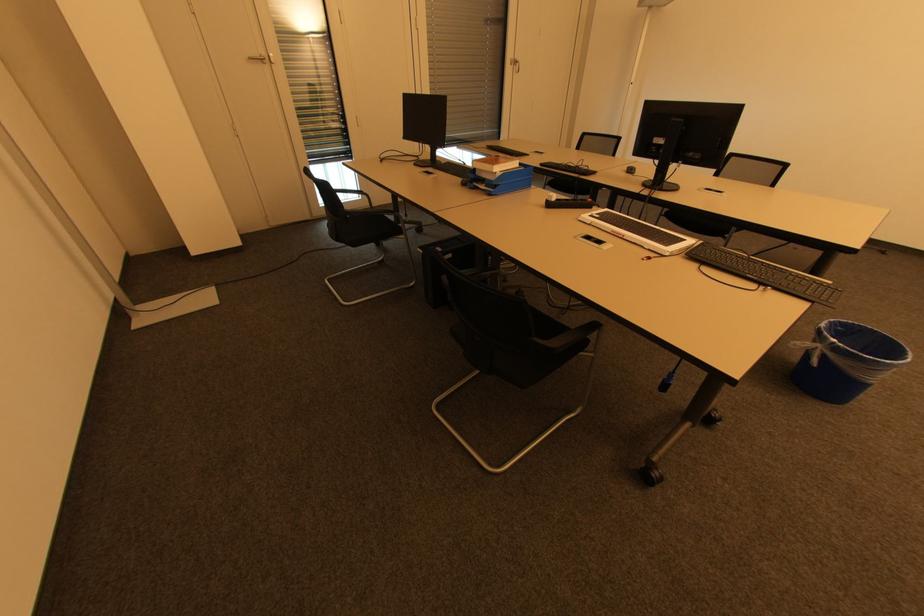
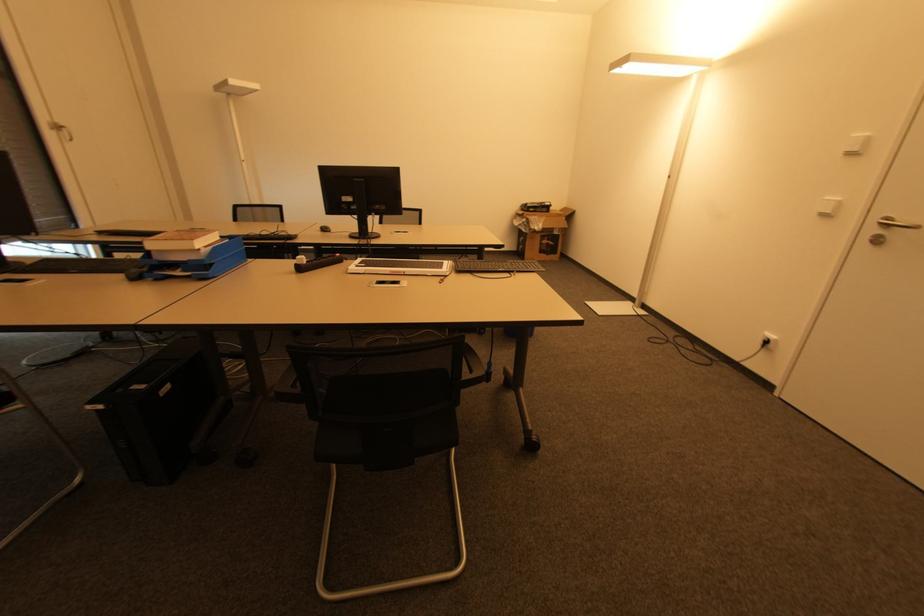
The point at (484,187) is marked in the first image. Where is the corresponding point in the second image?

(178, 274)